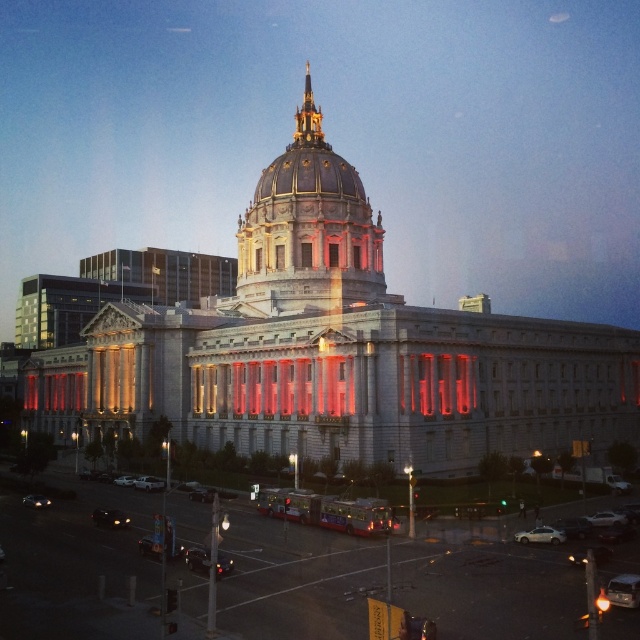
From the picture: Is shiny black car at lower left bigger than shiny black sedan at lower left?

Yes, shiny black car at lower left is bigger than shiny black sedan at lower left.

Who is more forward, (92, 516) or (35, 506)?

Point (92, 516) is more forward.

Locate an element on the screen. The image size is (640, 640). shiny black car at lower left is located at coordinates (109, 516).

Measure the distance between point (186,554) and camera.

51.09 meters

Does point (195, 568) come in front of point (35, 499)?

That is True.

Describe the element at coordinates (196, 557) in the screenshot. The image size is (640, 640). I see `shiny black sedan at center` at that location.

In order to click on shiny black sedan at center in this screenshot , I will do `click(196, 557)`.

Is shiny black sedan at center positioned at the back of silver metallic sedan at center?

No.

Does point (186, 560) come in front of point (154, 484)?

Yes.

Who is more distant from viewer, (192, 548) or (160, 483)?

The point (160, 483) is behind.

Identify the location of shiny black sedan at center. (196, 557).